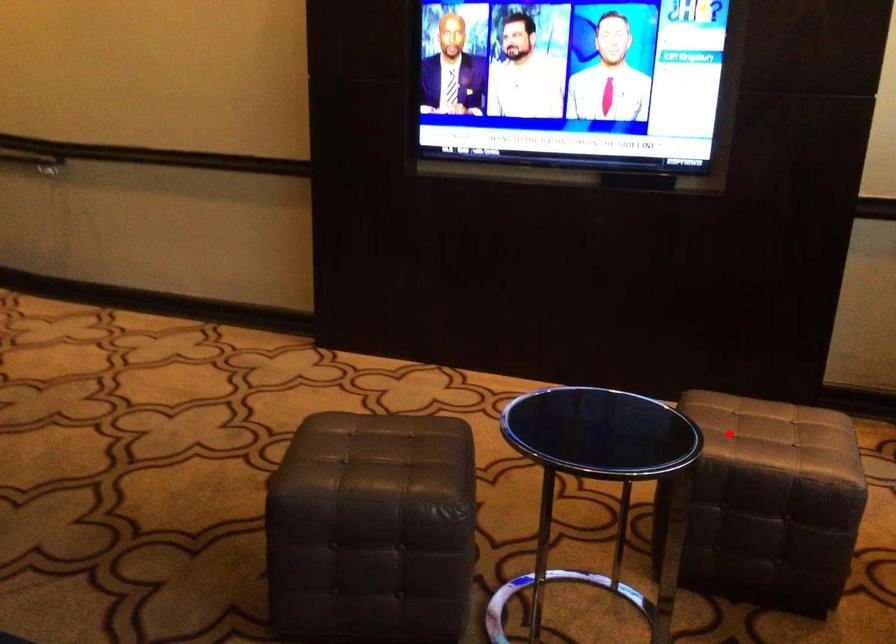
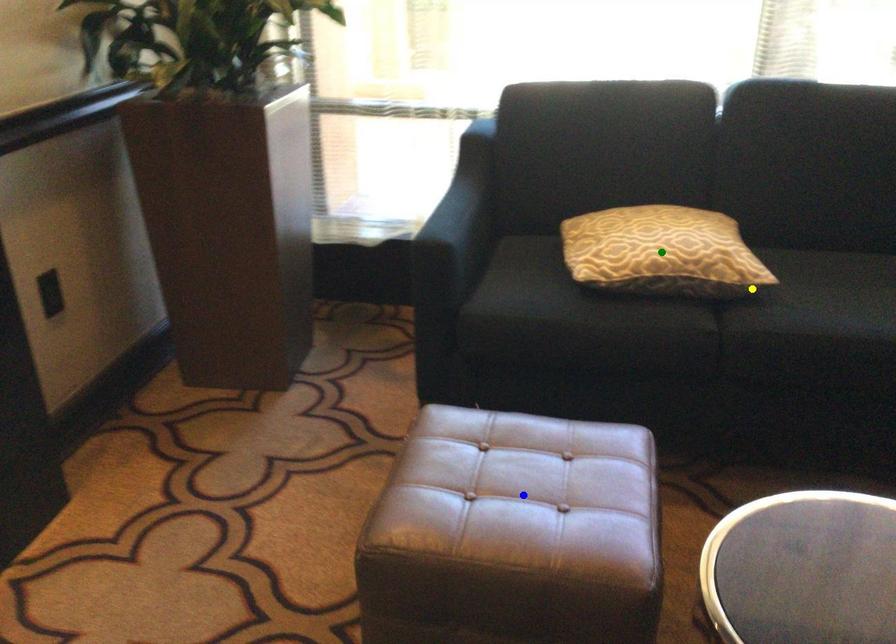
Question: I am providing you with two images of the same scene from different viewpoints. A red point is marked on the first image. You are given multiple points on the second image. In image 2, which mark is for the same physical point as the one in image 1?

Choices:
 (A) green point
 (B) yellow point
 (C) blue point

Answer: (C)